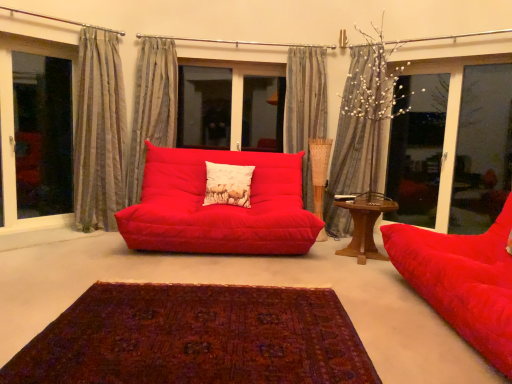
Image resolution: width=512 pixels, height=384 pixels. What do you see at coordinates (307, 119) in the screenshot?
I see `gray striped curtain at upper center, the 2th curtain in the right-to-left sequence` at bounding box center [307, 119].

At what (x,y) coordinates should I click in order to perform the action: click on gray striped curtain at upper center, arranged as the 3th curtain when viewed from the left. Please return your answer as a coordinate pair (x, y). The width and height of the screenshot is (512, 384). Looking at the image, I should click on click(x=307, y=119).

Identify the location of striped fabric curtain at left, placed as the fourth curtain when sorted from right to left. (98, 132).

Image resolution: width=512 pixels, height=384 pixels. What do you see at coordinates (196, 338) in the screenshot?
I see `deep burgundy woven rug at center` at bounding box center [196, 338].

How much space does transparent glass window at right, positioned as the 1th window in right-to-left order, occupy vertically?

The height of transparent glass window at right, positioned as the 1th window in right-to-left order, is 1.69 meters.

This screenshot has width=512, height=384. What do you see at coordinates (364, 229) in the screenshot?
I see `wooden table at right` at bounding box center [364, 229].

How much space does transparent glass window at left, marked as the first window in a left-to-right arrangement, occupy vertically?

The height of transparent glass window at left, marked as the first window in a left-to-right arrangement, is 5.70 feet.

You are a GUI agent. You are given a task and a screenshot of the screen. Output one action in this format:
    pyautogui.click(x=<x>, y=<y>)
    Task: Click on the gray striped curtain at upper center, the 2th curtain in the right-to-left sequence
    The height and width of the screenshot is (384, 512).
    Given the screenshot: What is the action you would take?
    pyautogui.click(x=307, y=119)

From the picture: Is the surface of textured gray curtain at center, acting as the third curtain starting from the right, in direct contact with matte red studio couch at center, positioned as the second studio couch in front-to-back order?

textured gray curtain at center, acting as the third curtain starting from the right, and matte red studio couch at center, positioned as the second studio couch in front-to-back order, are clearly separated.

Which of these two, textured gray curtain at center, marked as the second curtain in a left-to-right arrangement, or matte red studio couch at center, which is the 2th studio couch from right to left, stands taller?

Standing taller between the two is textured gray curtain at center, marked as the second curtain in a left-to-right arrangement.

Based on the photo, how many degrees apart are the facing directions of textured gray curtain at center, acting as the third curtain starting from the right, and matte red studio couch at center, which is the 2th studio couch from right to left?

4.59 degrees separate the facing orientations of textured gray curtain at center, acting as the third curtain starting from the right, and matte red studio couch at center, which is the 2th studio couch from right to left.

Starting from the textured gray curtain at center, acting as the third curtain starting from the right, which studio couch is the 1st one to the right? Please provide its 2D coordinates.

[(219, 206)]

From a real-world perspective, which object stands above the other?

beige textured pillow at center is physically above.

Between beige textured pillow at center and wooden table at right, which one appears on the right side from the viewer's perspective?

wooden table at right is more to the right.

From the picture: Is wooden table at right at the back of beige textured pillow at center?

No, beige textured pillow at center is not facing the opposite direction of wooden table at right.

From the image's perspective, is beige textured pillow at center above wooden table at right?

Yes.

Measure the distance between matte red beanbag at right, which is the 2th studio couch from left to right, and transparent glass window at left, the 2th window viewed from the right.

A distance of 3.50 meters exists between matte red beanbag at right, which is the 2th studio couch from left to right, and transparent glass window at left, the 2th window viewed from the right.

Would you say matte red beanbag at right, positioned as the second studio couch in back-to-front order, is a long distance from transparent glass window at left, marked as the first window in a left-to-right arrangement?

Indeed, matte red beanbag at right, positioned as the second studio couch in back-to-front order, is not near transparent glass window at left, marked as the first window in a left-to-right arrangement.

From the image's perspective, is matte red beanbag at right, which ranks as the first studio couch in front-to-back order, above or below transparent glass window at left, marked as the first window in a left-to-right arrangement?

Clearly, from the image's perspective, matte red beanbag at right, which ranks as the first studio couch in front-to-back order, is below transparent glass window at left, marked as the first window in a left-to-right arrangement.

Considering the relative sizes of matte red beanbag at right, which ranks as the first studio couch in front-to-back order, and transparent glass window at left, the 2th window viewed from the right, in the image provided, is matte red beanbag at right, which ranks as the first studio couch in front-to-back order, thinner than transparent glass window at left, the 2th window viewed from the right,?

No, matte red beanbag at right, which ranks as the first studio couch in front-to-back order, is not thinner than transparent glass window at left, the 2th window viewed from the right.

Can we say transparent glass window at left, the 2th window viewed from the right, lies outside wooden table at right?

transparent glass window at left, the 2th window viewed from the right, is positioned outside wooden table at right.

Are transparent glass window at left, the 2th window viewed from the right, and wooden table at right located far from each other?

transparent glass window at left, the 2th window viewed from the right, is far away from wooden table at right.

Does point (6, 110) come behind point (355, 224)?

Yes, it is.

Which object is more forward, transparent glass window at left, marked as the first window in a left-to-right arrangement, or wooden table at right?

wooden table at right is more forward.

Between wooden table at right and matte red beanbag at right, acting as the first studio couch starting from the right, which one has less height?

With less height is wooden table at right.

From the image's perspective, is wooden table at right above or below matte red beanbag at right, acting as the first studio couch starting from the right?

wooden table at right is below matte red beanbag at right, acting as the first studio couch starting from the right.

Is wooden table at right located outside matte red beanbag at right, positioned as the second studio couch in back-to-front order?

Yes, wooden table at right is outside of matte red beanbag at right, positioned as the second studio couch in back-to-front order.

Identify the location of table below the matte red beanbag at right, acting as the first studio couch starting from the right (from the image's perspective). The image size is (512, 384). (364, 229).

Is matte red beanbag at right, which ranks as the first studio couch in front-to-back order, bigger than textured gray curtain at center, marked as the second curtain in a left-to-right arrangement?

Correct, matte red beanbag at right, which ranks as the first studio couch in front-to-back order, is larger in size than textured gray curtain at center, marked as the second curtain in a left-to-right arrangement.

From a real-world perspective, is matte red beanbag at right, which ranks as the first studio couch in front-to-back order, located higher than textured gray curtain at center, marked as the second curtain in a left-to-right arrangement?

No, from a real-world perspective, matte red beanbag at right, which ranks as the first studio couch in front-to-back order, is not on top of textured gray curtain at center, marked as the second curtain in a left-to-right arrangement.

Could you tell me if matte red beanbag at right, which is the 2th studio couch from left to right, is turned towards textured gray curtain at center, acting as the third curtain starting from the right?

No, matte red beanbag at right, which is the 2th studio couch from left to right, does not turn towards textured gray curtain at center, acting as the third curtain starting from the right.

I want to click on the 3rd curtain above the matte red beanbag at right, which ranks as the first studio couch in front-to-back order (from the image's perspective), so click(x=152, y=107).

From the image's perspective, is transparent glass window at left, the 2th window viewed from the right, beneath striped fabric curtain at left, the 1th curtain in the left-to-right sequence?

Correct, transparent glass window at left, the 2th window viewed from the right, appears lower than striped fabric curtain at left, the 1th curtain in the left-to-right sequence, in the image.

In the scene shown: Considering the positions of objects transparent glass window at left, the 2th window viewed from the right, and striped fabric curtain at left, the 1th curtain in the left-to-right sequence, in the image provided, who is more to the right, transparent glass window at left, the 2th window viewed from the right, or striped fabric curtain at left, the 1th curtain in the left-to-right sequence,?

striped fabric curtain at left, the 1th curtain in the left-to-right sequence, is more to the right.

Is point (15, 35) closer to viewer compared to point (89, 162)?

Yes, point (15, 35) is in front of point (89, 162).

Between transparent glass window at left, the 2th window viewed from the right, and striped fabric curtain at left, placed as the fourth curtain when sorted from right to left, which one has smaller size?

With smaller size is transparent glass window at left, the 2th window viewed from the right.

Image resolution: width=512 pixels, height=384 pixels. There is a textured gray curtain at center, marked as the second curtain in a left-to-right arrangement. Find the location of `the 1st studio couch below it (from a real-world perspective)`. the 1st studio couch below it (from a real-world perspective) is located at coordinates (219, 206).

The height and width of the screenshot is (384, 512). I want to click on table in front of the beige textured pillow at center, so click(364, 229).

Considering their positions, is deep burgundy woven rug at center positioned further to wooden table at right than striped fabric curtain at left, placed as the fourth curtain when sorted from right to left?

striped fabric curtain at left, placed as the fourth curtain when sorted from right to left, lies further to wooden table at right than the other object.

When comparing their distances from striped fabric curtain at left, placed as the fourth curtain when sorted from right to left, does wooden table at right or transparent glass window at right, positioned as the 1th window in right-to-left order, seem further?

transparent glass window at right, positioned as the 1th window in right-to-left order, is positioned further to the anchor striped fabric curtain at left, placed as the fourth curtain when sorted from right to left.

Based on their spatial positions, is transparent glass window at left, marked as the first window in a left-to-right arrangement, or beige textured pillow at center closer to matte red beanbag at right, which ranks as the first studio couch in front-to-back order?

beige textured pillow at center is positioned closer to the anchor matte red beanbag at right, which ranks as the first studio couch in front-to-back order.

Which object lies nearer to the anchor point deep burgundy woven rug at center, gray striped curtain at upper right, which ranks as the 1th curtain in right-to-left order, or matte red studio couch at center, which is the 2th studio couch from right to left?

matte red studio couch at center, which is the 2th studio couch from right to left, is positioned closer to the anchor deep burgundy woven rug at center.

Based on their spatial positions, is matte red studio couch at center, the 1th studio couch viewed from the back, or gray striped curtain at upper center, arranged as the 3th curtain when viewed from the left, further from transparent glass window at right, the 2th window when ordered from left to right?

matte red studio couch at center, the 1th studio couch viewed from the back, is positioned further to the anchor transparent glass window at right, the 2th window when ordered from left to right.

Considering their positions, is textured gray curtain at center, marked as the second curtain in a left-to-right arrangement, positioned further to transparent glass window at left, the 2th window viewed from the right, than wooden table at right?

wooden table at right is further to transparent glass window at left, the 2th window viewed from the right.

Estimate the real-world distances between objects in this image. Which object is closer to deep burgundy woven rug at center, matte red studio couch at center, which ranks as the first studio couch in left-to-right order, or textured gray curtain at center, marked as the second curtain in a left-to-right arrangement?

Based on the image, matte red studio couch at center, which ranks as the first studio couch in left-to-right order, appears to be nearer to deep burgundy woven rug at center.

From the image, which object appears to be nearer to transparent glass window at right, positioned as the 1th window in right-to-left order, deep burgundy woven rug at center or matte red studio couch at center, which ranks as the first studio couch in left-to-right order?

matte red studio couch at center, which ranks as the first studio couch in left-to-right order.

You are a GUI agent. You are given a task and a screenshot of the screen. Output one action in this format:
    pyautogui.click(x=<x>, y=<y>)
    Task: Click on the curtain between deep burgundy woven rug at center and gray striped curtain at upper right, the fourth curtain positioned from the left, from front to back
    The height and width of the screenshot is (384, 512).
    Given the screenshot: What is the action you would take?
    pyautogui.click(x=98, y=132)

Find the location of `pillow situated between textured gray curtain at center, acting as the third curtain starting from the right, and transparent glass window at right, the 2th window when ordered from left to right, from left to right`. pillow situated between textured gray curtain at center, acting as the third curtain starting from the right, and transparent glass window at right, the 2th window when ordered from left to right, from left to right is located at coordinates (x=228, y=184).

The image size is (512, 384). In order to click on pillow between deep burgundy woven rug at center and gray striped curtain at upper right, which ranks as the 1th curtain in right-to-left order, along the z-axis in this screenshot , I will do point(228,184).

This screenshot has height=384, width=512. In order to click on curtain between textured gray curtain at center, acting as the third curtain starting from the right, and gray striped curtain at upper right, the fourth curtain positioned from the left, in the horizontal direction in this screenshot , I will do tap(307, 119).